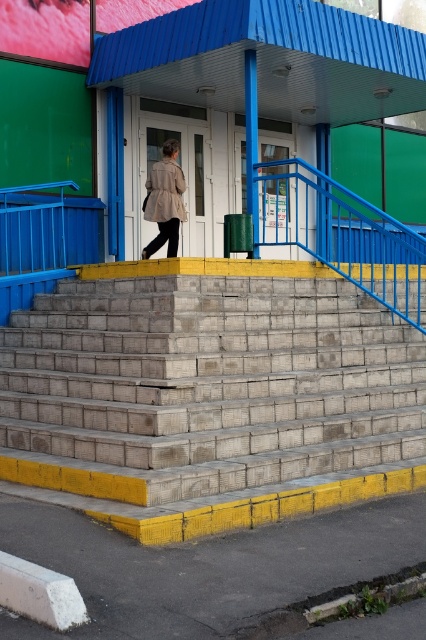
Is point (302, 406) positioned in front of point (285, 195)?

Yes.

Does concrete stairs at center have a larger size compared to blue metal/rail at upper center?

Indeed, concrete stairs at center has a larger size compared to blue metal/rail at upper center.

Is point (298, 513) farther from camera compared to point (365, 268)?

No, (298, 513) is in front of (365, 268).

Where is `concrete stairs at center`? Image resolution: width=426 pixels, height=640 pixels. concrete stairs at center is located at coordinates (209, 401).

Is concrete stairs at center taller than beige textured coat at center?

Yes.

Is point (388, 472) positioned in front of point (178, 198)?

Yes.

At what (x,y) coordinates should I click in order to perform the action: click on concrete stairs at center. Please return your answer as a coordinate pair (x, y). The width and height of the screenshot is (426, 640). Looking at the image, I should click on (209, 401).

This screenshot has width=426, height=640. Find the location of `concrete stairs at center`. concrete stairs at center is located at coordinates (209, 401).

Can you confirm if blue metal/rail at upper center is positioned above beige textured coat at center?

Incorrect, blue metal/rail at upper center is not positioned above beige textured coat at center.

Who is shorter, blue metal/rail at upper center or beige textured coat at center?

beige textured coat at center

Is point (342, 211) closer to viewer compared to point (154, 218)?

No, it is behind (154, 218).

Identify the location of blue metal/rail at upper center. (342, 234).